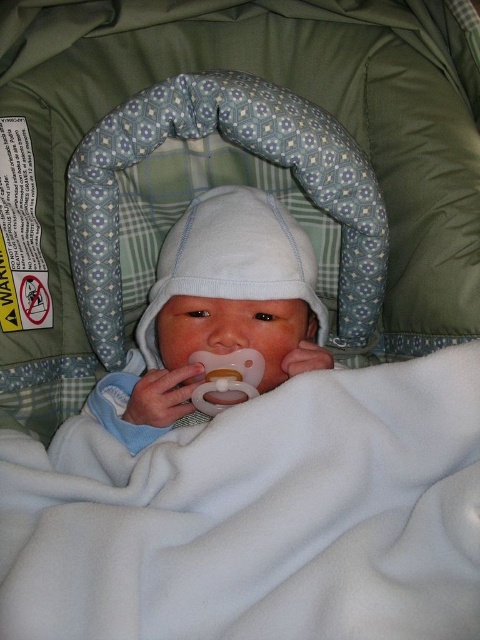
You are a caregiver holding a baby in a carrier. You notice two points marked on the carrier. The first point is at coordinate point(478, 372) and the second is at point(225, 189). If you want to place a small toy so it is closer to the baby, which point should you choose?

Point(478, 372) is in front of point(225, 189), so placing the toy at point(478, 372) would make it closer to the baby.

You are a caregiver holding a newborn baby in a carrier. You need to check if the white fleece blanket at center is within reach to adjust it. Your hand can extend 20 inches. Is the blanket within your reach?

The white fleece blanket at center is 21.15 inches from viewer, which is slightly beyond the caregiver hand extension of 20 inches. The blanket is just out of reach, so the caregiver would need to move closer or use another method to adjust it.

You are a caregiver holding a newborn baby and need to check if the baby can breathe properly. The baby is wrapped in the white fleece blanket at center and the white soft baby at center is underneath. Is the blanket covering the baby in a way that might block the baby breathing?

The white fleece blanket at center is in front of the white soft baby at center, which means the blanket is directly covering the baby. This could potentially block the baby from breathing properly, so it should be adjusted to ensure the baby has clear airways.